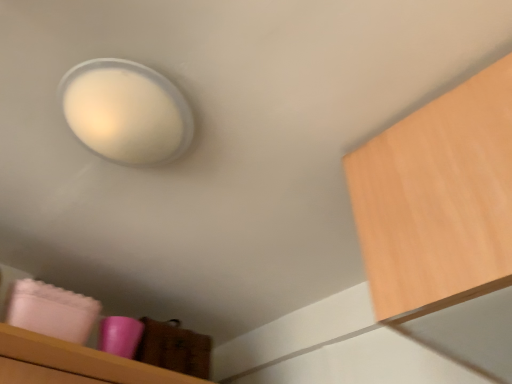
In order to face light wood cabinet at upper right, should I rotate leftwards or rightwards?

You should rotate right by 30.783 degrees.

Describe the element at coordinates (438, 200) in the screenshot. I see `light wood cabinet at upper right` at that location.

The image size is (512, 384). Identify the location of light wood cabinet at upper right. (438, 200).

You are a GUI agent. You are given a task and a screenshot of the screen. Output one action in this format:
    pyautogui.click(x=<x>, y=<y>)
    Task: Click on the light wood cabinet at upper right
    The image size is (512, 384).
    Given the screenshot: What is the action you would take?
    pyautogui.click(x=438, y=200)